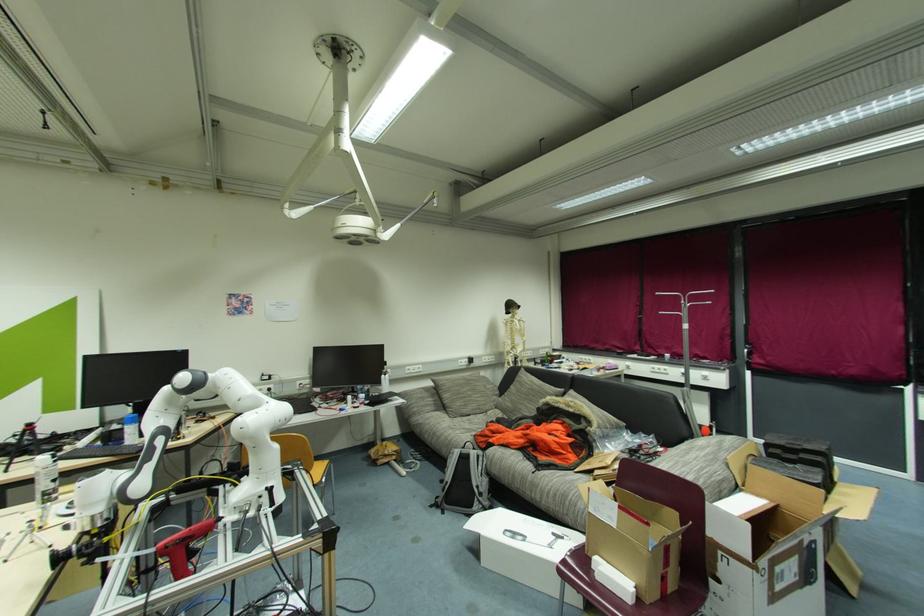
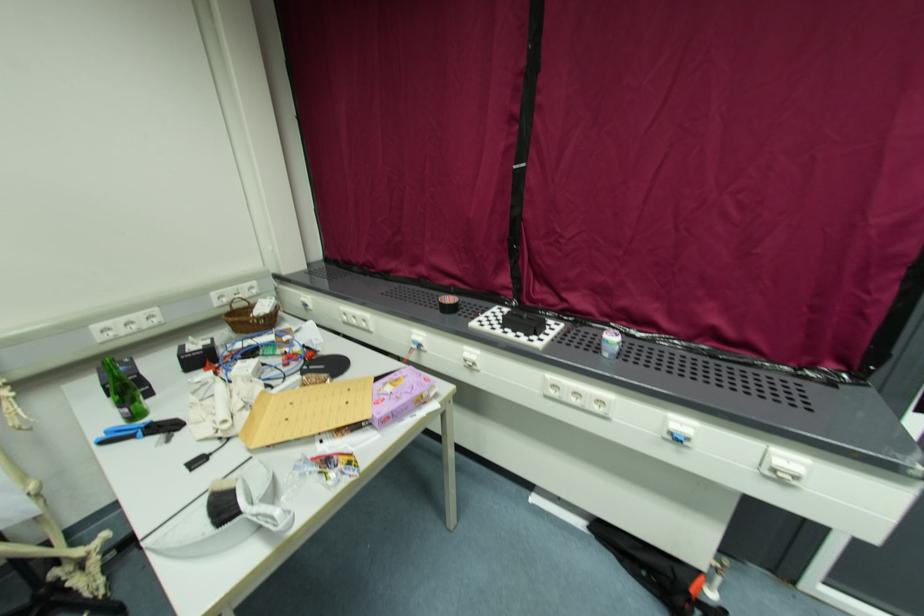
Find the pixel in the second image that matches (631,363) in the first image.

(476, 352)